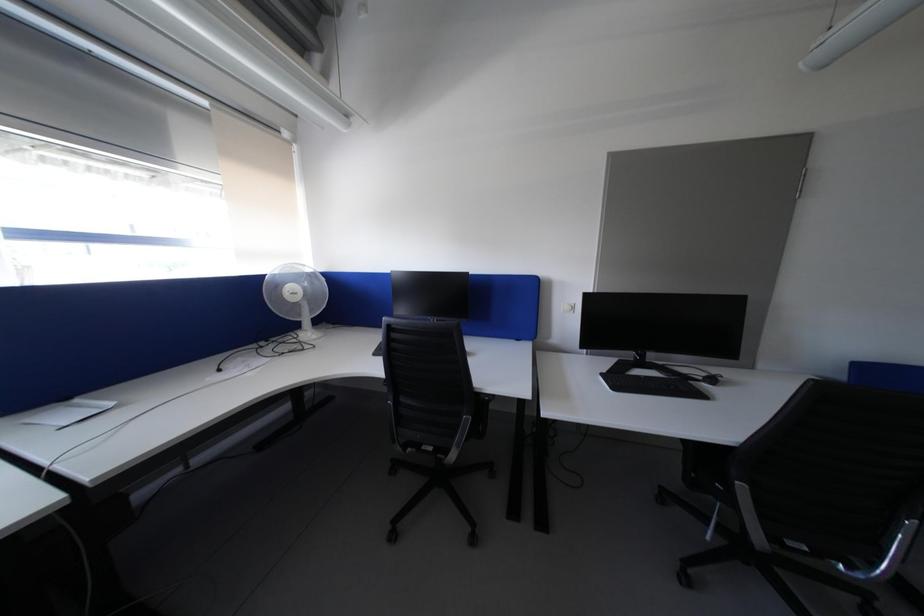
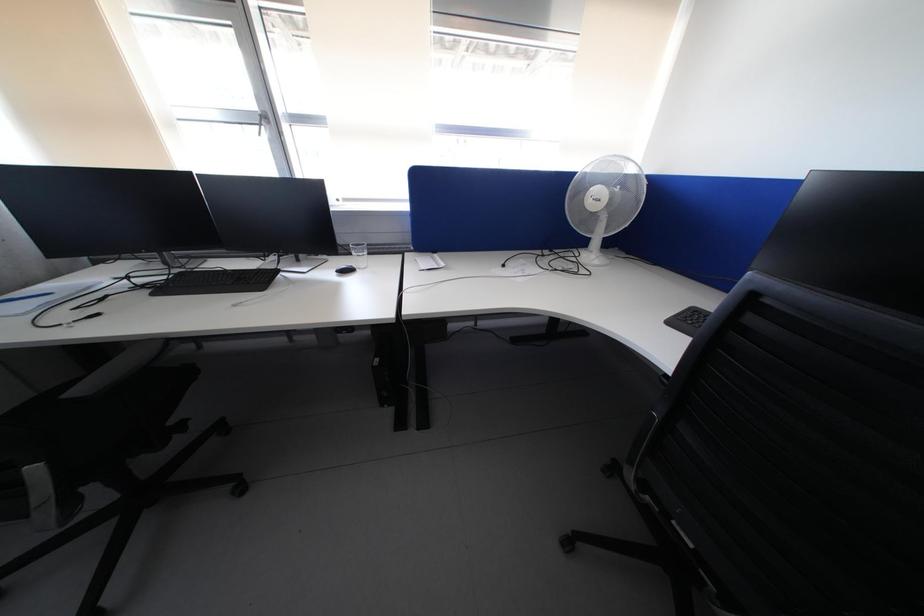
Based on the continuous images, in which direction is the camera rotating?

The rotation direction of the camera is left-down.